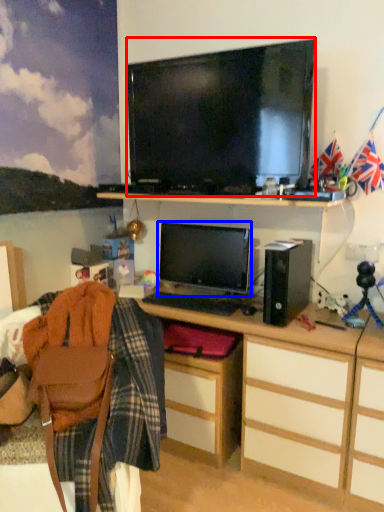
Question: Which object is closer to the camera taking this photo, television (highlighted by a red box) or computer monitor (highlighted by a blue box)?

Choices:
 (A) television
 (B) computer monitor

Answer: (A)